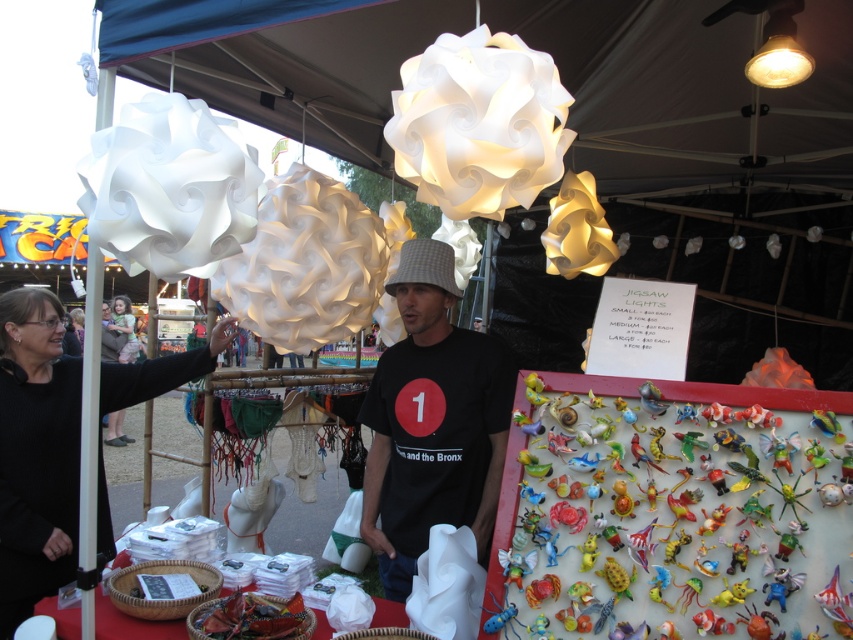
Measure the distance from white matte paper lantern at center to matte white bulb at upper right.

white matte paper lantern at center and matte white bulb at upper right are 5.76 feet apart.

Is the position of white matte paper lantern at center less distant than that of matte white bulb at upper right?

Yes, it is in front of matte white bulb at upper right.

Who is more forward, (287, 236) or (784, 36)?

Positioned in front is point (784, 36).

This screenshot has width=853, height=640. I want to click on white matte paper lantern at center, so click(x=305, y=264).

Is white matte paper lantern at upper left thinner than white matte paper lantern at center?

Correct, white matte paper lantern at upper left's width is less than white matte paper lantern at center's.

Measure the distance between point [190,109] and camera.

Point [190,109] is 4.95 feet away from camera.

Find the location of `white matte paper lantern at upper left`. white matte paper lantern at upper left is located at coordinates (169, 188).

Is white paper lampshades at upper center below black matte t-shirt at center?

Actually, white paper lampshades at upper center is above black matte t-shirt at center.

Is white paper lampshades at upper center bigger than black matte t-shirt at center?

Yes.

Who is more forward, (676, 122) or (471, 481)?

Point (471, 481) is in front.

Locate an element on the screen. white paper lampshades at upper center is located at coordinates (692, 96).